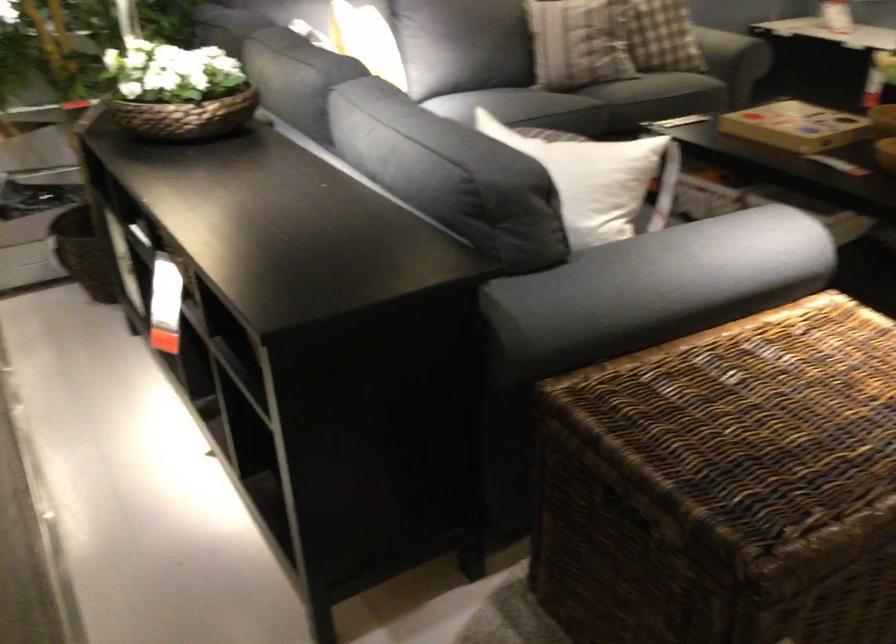
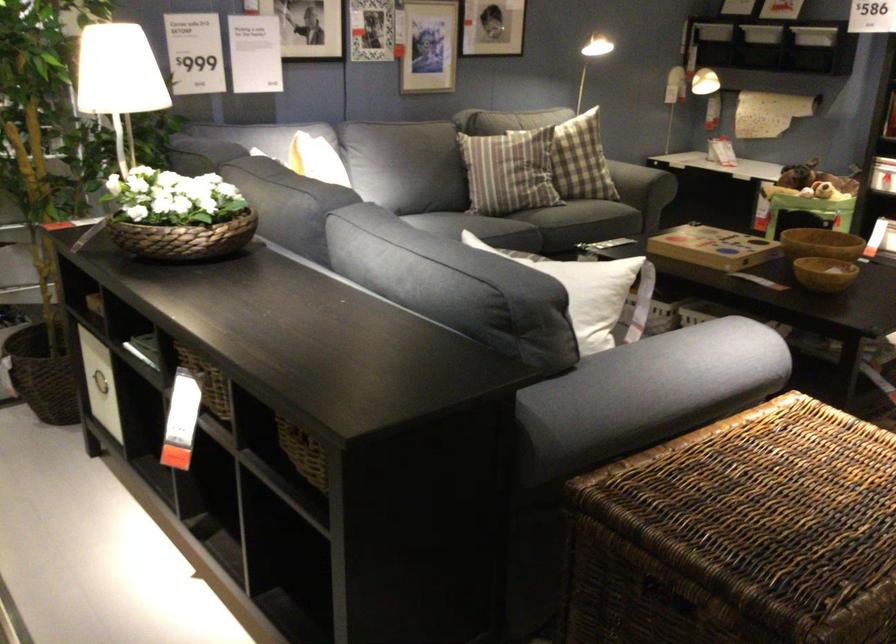
In the second image, find the point that corresponds to pixel 767 427 in the first image.

(776, 509)